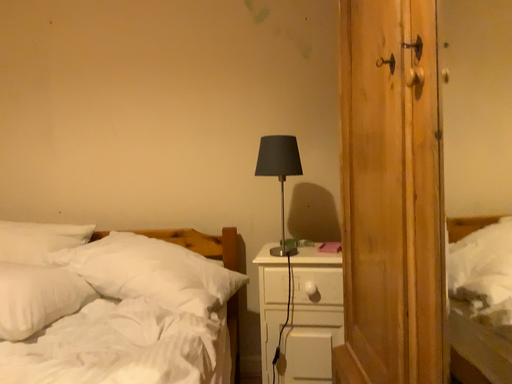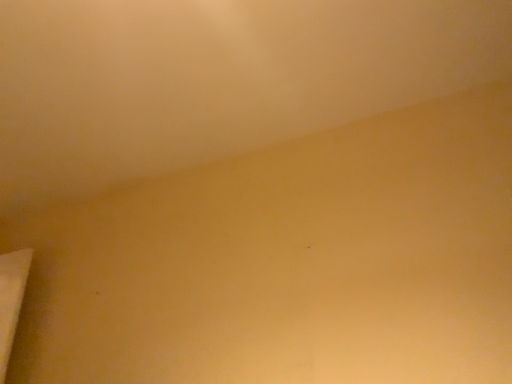
Question: How did the camera likely rotate when shooting the video?

Choices:
 (A) rotated left
 (B) rotated right

Answer: (A)